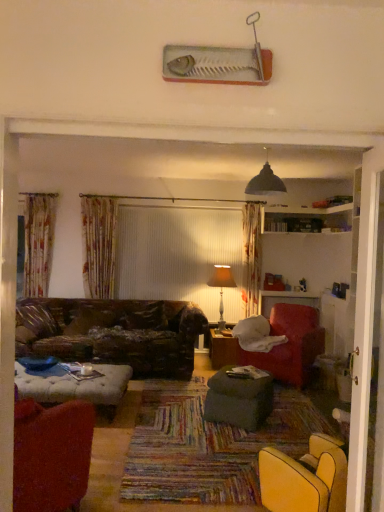
Question: From a real-world perspective, is black matte lampshade at upper center located beneath velvet red armchair at right, placed as the 2th chair when sorted from left to right?

Choices:
 (A) yes
 (B) no

Answer: (B)

Question: Can you confirm if black matte lampshade at upper center is wider than velvet red armchair at right, placed as the 2th chair when sorted from left to right?

Choices:
 (A) no
 (B) yes

Answer: (A)

Question: From the image's perspective, does black matte lampshade at upper center appear lower than velvet red armchair at right, arranged as the first chair when viewed from the right?

Choices:
 (A) no
 (B) yes

Answer: (A)

Question: Does black matte lampshade at upper center appear on the right side of velvet red armchair at right, acting as the 1th chair starting from the back?

Choices:
 (A) no
 (B) yes

Answer: (A)

Question: Does black matte lampshade at upper center have a lesser height compared to velvet red armchair at right, which is the 2th chair from front to back?

Choices:
 (A) yes
 (B) no

Answer: (A)

Question: Considering the relative sizes of black matte lampshade at upper center and velvet red armchair at right, arranged as the first chair when viewed from the right, in the image provided, is black matte lampshade at upper center smaller than velvet red armchair at right, arranged as the first chair when viewed from the right,?

Choices:
 (A) no
 (B) yes

Answer: (B)

Question: Does dark green fabric ottoman at center, which appears as the second table when viewed from the back, have a larger size compared to velvet red armchair at lower left, which is the second chair from right to left?

Choices:
 (A) yes
 (B) no

Answer: (B)

Question: Is dark green fabric ottoman at center, which appears as the second table when viewed from the back, oriented towards velvet red armchair at lower left, which is the second chair from back to front?

Choices:
 (A) no
 (B) yes

Answer: (A)

Question: From a real-world perspective, is dark green fabric ottoman at center, which appears as the second table when viewed from the back, beneath velvet red armchair at lower left, the first chair in the front-to-back sequence?

Choices:
 (A) no
 (B) yes

Answer: (B)

Question: From the image's perspective, would you say dark green fabric ottoman at center, which appears as the second table when viewed from the back, is positioned over velvet red armchair at lower left, which is the second chair from right to left?

Choices:
 (A) no
 (B) yes

Answer: (A)

Question: Considering the relative sizes of dark green fabric ottoman at center, which appears as the second table when viewed from the back, and velvet red armchair at lower left, which is the second chair from right to left, in the image provided, is dark green fabric ottoman at center, which appears as the second table when viewed from the back, shorter than velvet red armchair at lower left, which is the second chair from right to left,?

Choices:
 (A) no
 (B) yes

Answer: (B)

Question: Considering the relative positions of dark green fabric ottoman at center, which appears as the second table when viewed from the back, and velvet red armchair at lower left, marked as the first chair in a left-to-right arrangement, in the image provided, is dark green fabric ottoman at center, which appears as the second table when viewed from the back, behind velvet red armchair at lower left, marked as the first chair in a left-to-right arrangement,?

Choices:
 (A) yes
 (B) no

Answer: (A)

Question: Is matte beige lampshade at center to the left of black matte lampshade at upper center from the viewer's perspective?

Choices:
 (A) no
 (B) yes

Answer: (B)